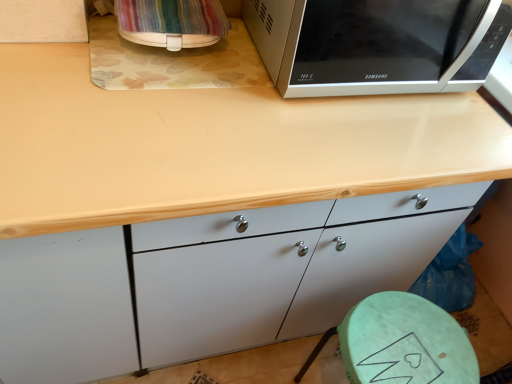
Question: Is green matte stool at lower right not near striped fabric bag at upper left?

Choices:
 (A) yes
 (B) no

Answer: (B)

Question: Considering the relative sizes of green matte stool at lower right and striped fabric bag at upper left in the image provided, is green matte stool at lower right shorter than striped fabric bag at upper left?

Choices:
 (A) no
 (B) yes

Answer: (A)

Question: Would you say green matte stool at lower right is outside striped fabric bag at upper left?

Choices:
 (A) yes
 (B) no

Answer: (A)

Question: Would you say green matte stool at lower right contains striped fabric bag at upper left?

Choices:
 (A) no
 (B) yes

Answer: (A)

Question: From a real-world perspective, does green matte stool at lower right sit lower than striped fabric bag at upper left?

Choices:
 (A) yes
 (B) no

Answer: (A)

Question: Is wooden at upper center wider or thinner than striped fabric bag at upper left?

Choices:
 (A) thin
 (B) wide

Answer: (B)

Question: From the image's perspective, is wooden at upper center located above or below striped fabric bag at upper left?

Choices:
 (A) below
 (B) above

Answer: (A)

Question: Would you say wooden at upper center is inside or outside striped fabric bag at upper left?

Choices:
 (A) outside
 (B) inside

Answer: (A)

Question: Considering the positions of point (220, 160) and point (150, 8), is point (220, 160) closer or farther from the camera than point (150, 8)?

Choices:
 (A) closer
 (B) farther

Answer: (A)

Question: In the image, is sleek silver microwave at upper right on the left side or the right side of green matte stool at lower right?

Choices:
 (A) left
 (B) right

Answer: (A)

Question: From a real-world perspective, relative to green matte stool at lower right, is sleek silver microwave at upper right vertically above or below?

Choices:
 (A) below
 (B) above

Answer: (B)

Question: From the image's perspective, is sleek silver microwave at upper right positioned above or below green matte stool at lower right?

Choices:
 (A) below
 (B) above

Answer: (B)

Question: From their relative heights in the image, would you say sleek silver microwave at upper right is taller or shorter than green matte stool at lower right?

Choices:
 (A) short
 (B) tall

Answer: (A)

Question: Would you say sleek silver microwave at upper right is to the left or to the right of striped fabric bag at upper left in the picture?

Choices:
 (A) left
 (B) right

Answer: (B)

Question: Is sleek silver microwave at upper right inside or outside of striped fabric bag at upper left?

Choices:
 (A) inside
 (B) outside

Answer: (B)